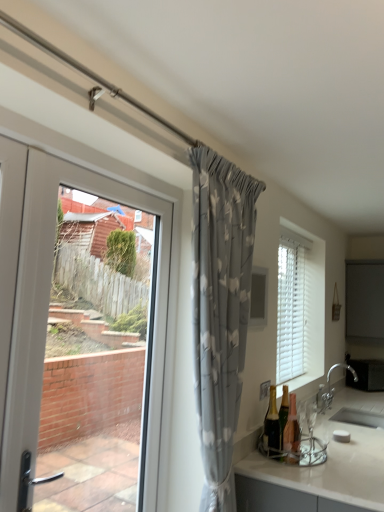
Question: Considering their positions, is silver metallic faucet at lower right located in front of or behind shiny gold bottle at lower right, acting as the second bottle starting from the right?

Choices:
 (A) front
 (B) behind

Answer: (B)

Question: From the image's perspective, is silver metallic faucet at lower right positioned above or below shiny gold bottle at lower right, which ranks as the 1th bottle in left-to-right order?

Choices:
 (A) above
 (B) below

Answer: (B)

Question: Estimate the real-world distances between objects in this image. Which object is farther from the shiny gold bottle at lower right, which ranks as the 1th bottle in left-to-right order?

Choices:
 (A) white glossy countertop at lower right
 (B) matte glass bottle at lower right, which is the 2th bottle in left-to-right order
 (C) white wood blinds at right
 (D) gray floral fabric curtain at center
 (E) clear glass window screen at upper center

Answer: (C)

Question: Which object is the closest to the silver metallic faucet at lower right?

Choices:
 (A) white plastic door at left
 (B) clear glass window screen at upper center
 (C) matte glass bottle at lower right, which is the 2th bottle in left-to-right order
 (D) shiny gold bottle at lower right, which ranks as the 1th bottle in left-to-right order
 (E) white wood blinds at right

Answer: (E)